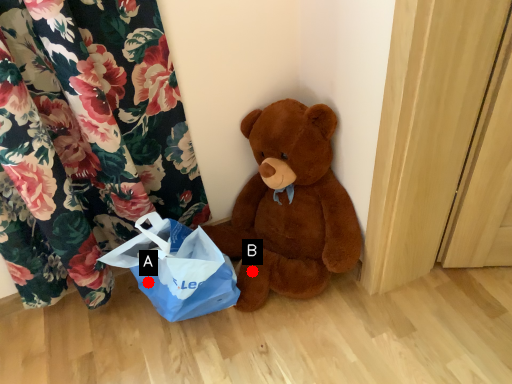
Question: Two points are circled on the image, labeled by A and B beside each circle. Which point is farther from the camera taking this photo?

Choices:
 (A) A is further
 (B) B is further

Answer: (B)